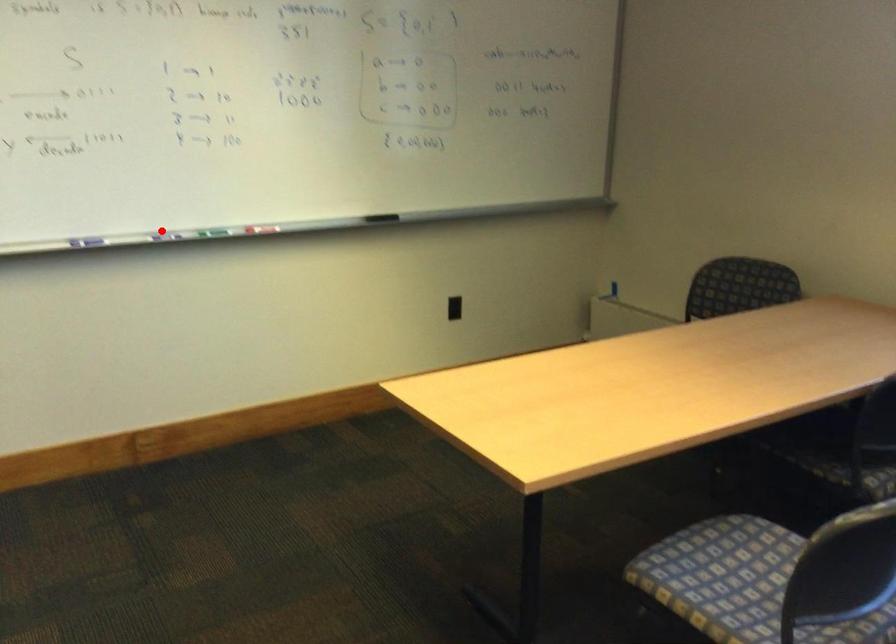
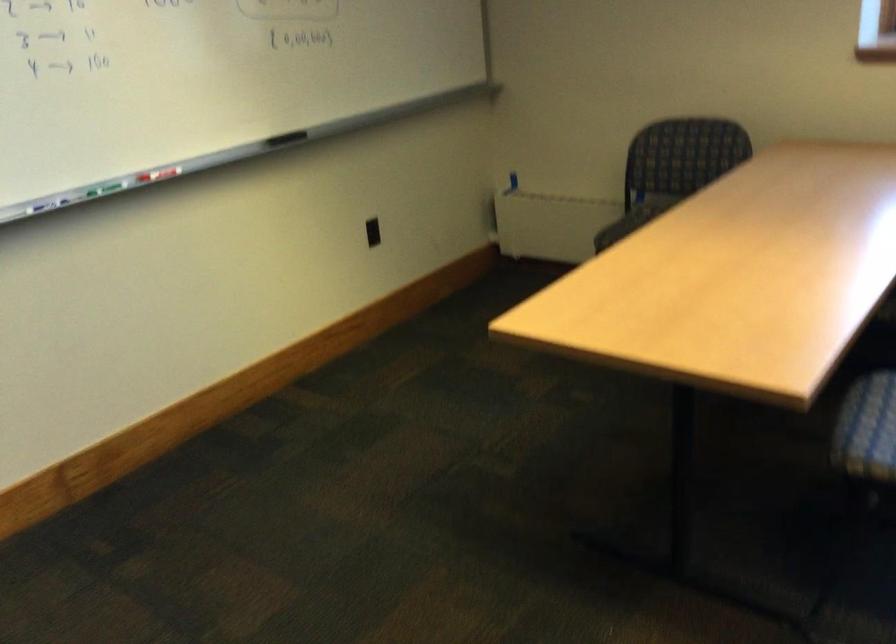
Find the pixel in the second image that matches the highlighted location in the first image.

(47, 204)